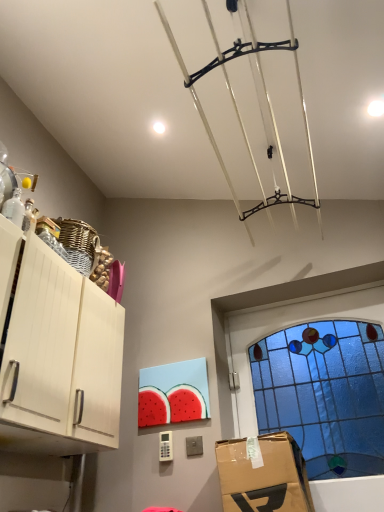
Question: Is transparent glass bottles at left turned away from blue stained glass window at upper right?

Choices:
 (A) no
 (B) yes

Answer: (A)

Question: Is transparent glass bottles at left to the right of blue stained glass window at upper right from the viewer's perspective?

Choices:
 (A) no
 (B) yes

Answer: (A)

Question: From the image's perspective, is transparent glass bottles at left located above blue stained glass window at upper right?

Choices:
 (A) no
 (B) yes

Answer: (B)

Question: Could you tell me if transparent glass bottles at left is turned towards blue stained glass window at upper right?

Choices:
 (A) no
 (B) yes

Answer: (A)

Question: From a real-world perspective, is transparent glass bottles at left beneath blue stained glass window at upper right?

Choices:
 (A) no
 (B) yes

Answer: (A)

Question: Does transparent glass bottles at left have a larger size compared to blue stained glass window at upper right?

Choices:
 (A) yes
 (B) no

Answer: (B)

Question: Is white matte cabinet at left in contact with transparent glass bottles at left?

Choices:
 (A) no
 (B) yes

Answer: (A)

Question: From a real-world perspective, is white matte cabinet at left located beneath transparent glass bottles at left?

Choices:
 (A) no
 (B) yes

Answer: (B)

Question: Is white matte cabinet at left to the right of transparent glass bottles at left from the viewer's perspective?

Choices:
 (A) no
 (B) yes

Answer: (B)

Question: Is white matte cabinet at left turned away from transparent glass bottles at left?

Choices:
 (A) no
 (B) yes

Answer: (A)

Question: From the image's perspective, is white matte cabinet at left above transparent glass bottles at left?

Choices:
 (A) yes
 (B) no

Answer: (B)

Question: Is white matte cabinet at left taller than transparent glass bottles at left?

Choices:
 (A) no
 (B) yes

Answer: (B)

Question: Is the position of white matte cabinet at left more distant than that of blue stained glass window at upper right?

Choices:
 (A) yes
 (B) no

Answer: (B)